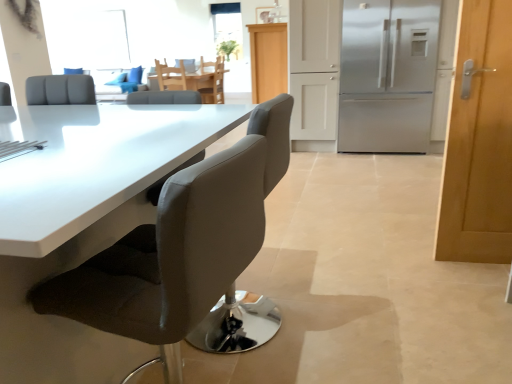
Question: Is clear glass window at upper center not within satin silver refrigerator at right?

Choices:
 (A) yes
 (B) no

Answer: (A)

Question: Can you confirm if clear glass window at upper center is positioned to the left of satin silver refrigerator at right?

Choices:
 (A) yes
 (B) no

Answer: (A)

Question: Is the depth of clear glass window at upper center less than that of satin silver refrigerator at right?

Choices:
 (A) yes
 (B) no

Answer: (B)

Question: From the image's perspective, is clear glass window at upper center below satin silver refrigerator at right?

Choices:
 (A) no
 (B) yes

Answer: (A)

Question: Does clear glass window at upper center touch satin silver refrigerator at right?

Choices:
 (A) no
 (B) yes

Answer: (A)

Question: Does clear glass window at upper center have a greater height compared to satin silver refrigerator at right?

Choices:
 (A) no
 (B) yes

Answer: (A)

Question: Is matte gray chair at center, positioned as the fourth chair in back-to-front order, shorter than light brown wooden chair at center, the 1th chair in the top-to-bottom sequence?

Choices:
 (A) no
 (B) yes

Answer: (A)

Question: Can you confirm if matte gray chair at center, acting as the 4th chair starting from the top, is positioned to the right of light brown wooden chair at center, acting as the 1th chair starting from the back?

Choices:
 (A) yes
 (B) no

Answer: (A)

Question: Is matte gray chair at center, the 1th chair in the bottom-to-top sequence, completely or partially outside of light brown wooden chair at center, acting as the fourth chair starting from the bottom?

Choices:
 (A) no
 (B) yes

Answer: (B)

Question: Does matte gray chair at center, acting as the 4th chair starting from the top, come in front of light brown wooden chair at center, the 1th chair in the top-to-bottom sequence?

Choices:
 (A) no
 (B) yes

Answer: (B)

Question: Can you confirm if matte gray chair at center, the 1th chair in the bottom-to-top sequence, is taller than light brown wooden chair at center, acting as the fourth chair starting from the bottom?

Choices:
 (A) yes
 (B) no

Answer: (A)

Question: Does matte gray chair at center, which is the 1th chair in front-to-back order, have a smaller size compared to light brown wooden chair at center, the 1th chair in the top-to-bottom sequence?

Choices:
 (A) no
 (B) yes

Answer: (A)

Question: Is there a large distance between suede-like gray chair at center, which is the 3th chair in top-to-bottom order, and light wood cabinet at center?

Choices:
 (A) no
 (B) yes

Answer: (B)